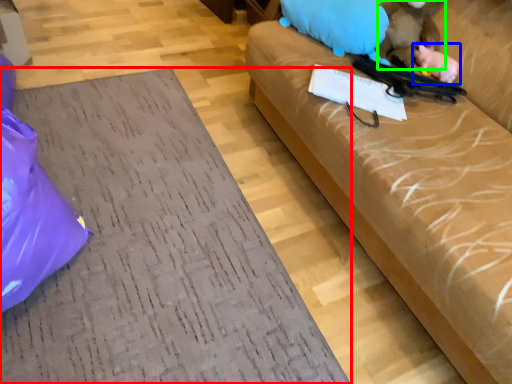
Question: Considering the real-world distances, which object is closest to furniture (highlighted by a red box)? animal (highlighted by a blue box) or animal (highlighted by a green box).

Choices:
 (A) animal
 (B) animal

Answer: (B)